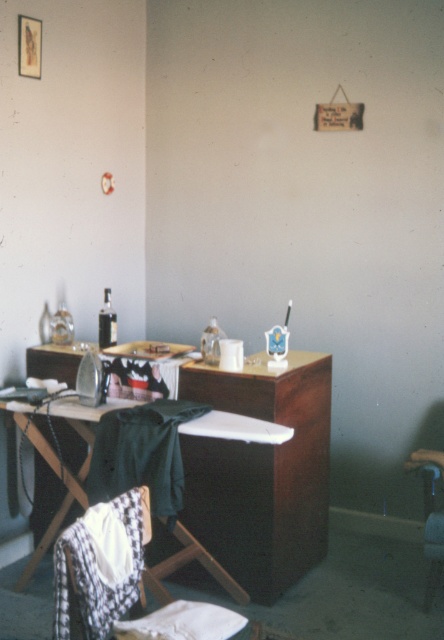
Question: Is dark green fabric at center bigger than wooden ironing board at center?

Choices:
 (A) yes
 (B) no

Answer: (B)

Question: From the image, what is the correct spatial relationship of dark green fabric at center in relation to white cotton cloth at lower center?

Choices:
 (A) right
 (B) left

Answer: (B)

Question: Estimate the real-world distances between objects in this image. Which object is farther from the white fabric armchair at lower left?

Choices:
 (A) white cotton cloth at lower center
 (B) dark green fabric at center
 (C) wooden ironing board at center
 (D) white knitted cloth at lower left

Answer: (C)

Question: Is white knitted cloth at lower left to the right of wooden ironing board at center from the viewer's perspective?

Choices:
 (A) yes
 (B) no

Answer: (A)

Question: Which of the following is the closest to the observer?

Choices:
 (A) (232, 435)
 (B) (115, 506)

Answer: (B)

Question: Which object is positioned closest to the white knitted cloth at lower left?

Choices:
 (A) dark green fabric at center
 (B) white fabric armchair at lower left

Answer: (B)